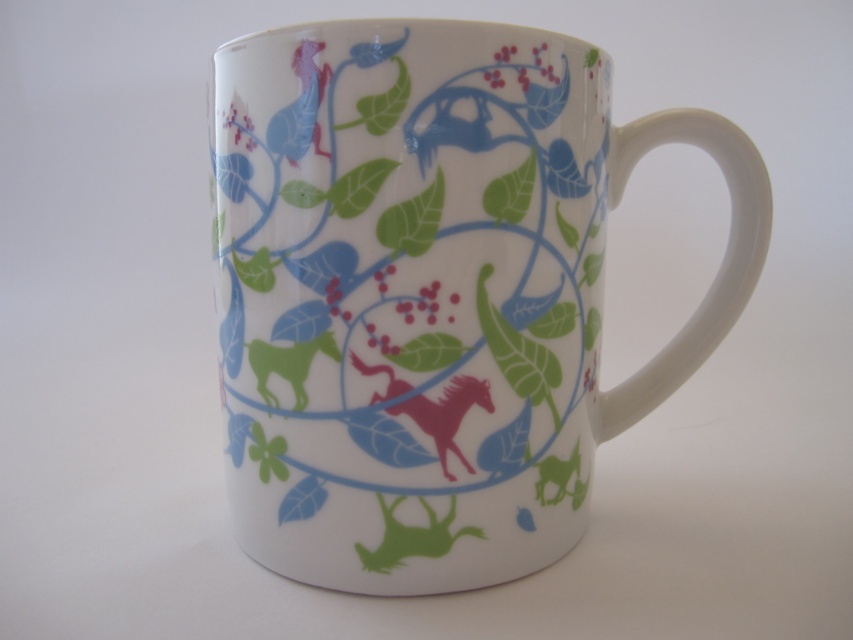
Question: Can you confirm if porcelain mug at center is wider than pink glossy horse at center?

Choices:
 (A) no
 (B) yes

Answer: (B)

Question: Is porcelain mug at center in front of pink glossy horse at center?

Choices:
 (A) no
 (B) yes

Answer: (B)

Question: Which point is closer to the camera taking this photo?

Choices:
 (A) (463, 342)
 (B) (352, 355)

Answer: (B)

Question: Which point is farther to the camera?

Choices:
 (A) (305, 129)
 (B) (451, 433)

Answer: (B)

Question: Is porcelain mug at center to the left of pink glossy horse at center from the viewer's perspective?

Choices:
 (A) no
 (B) yes

Answer: (A)